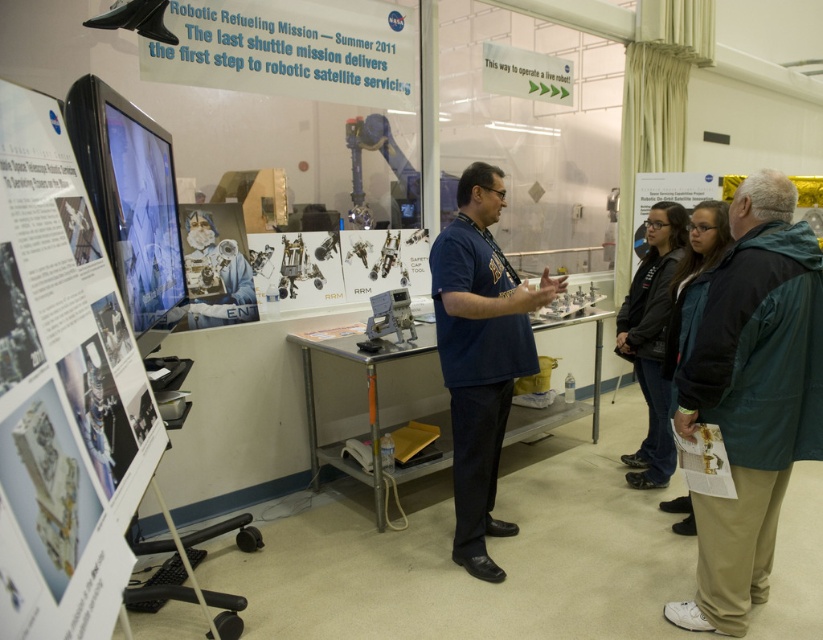
You are standing in front of the large monitor at the NASA exhibit. You notice two jackets in the scene. Which jacket, the green fabric jacket at lower right or the dark blue jacket at center, is closer to you?

The green fabric jacket at lower right is closer to the viewer than the dark blue jacket at center.

You are a visitor at the science exhibition and want to take a photo of the large monitor displaying the NASA mission details. You are currently standing at the position where the green fabric jacket at lower right is located. Is there enough space for you to move closer to the monitor to take a clear photo without needing to step over any obstacles?

The distance between you and the camera is 1.95 meters. Since you want to move closer to the monitor, you have sufficient space as 1.95 meters allows you to step forward towards the monitor without obstacles, assuming the path is clear as described in the scene.